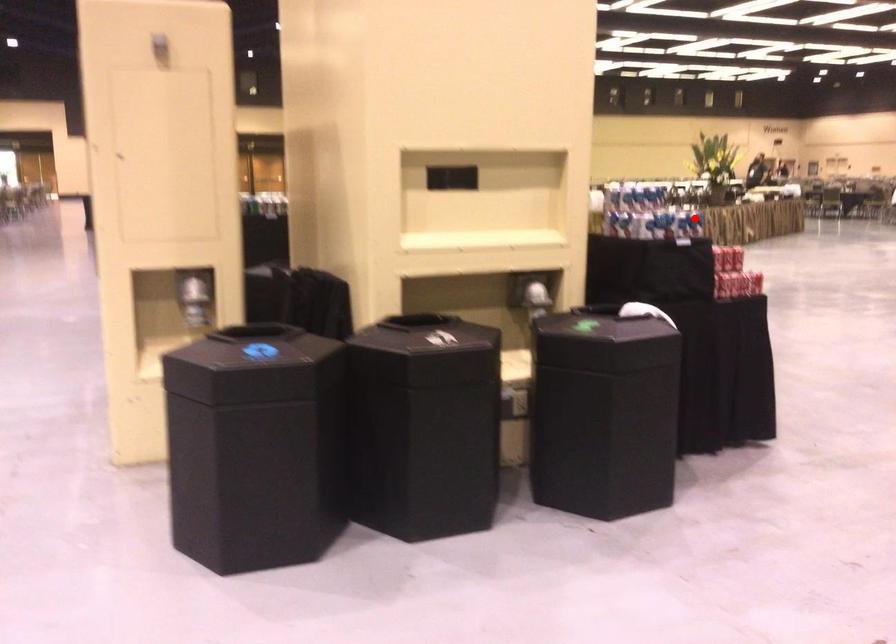
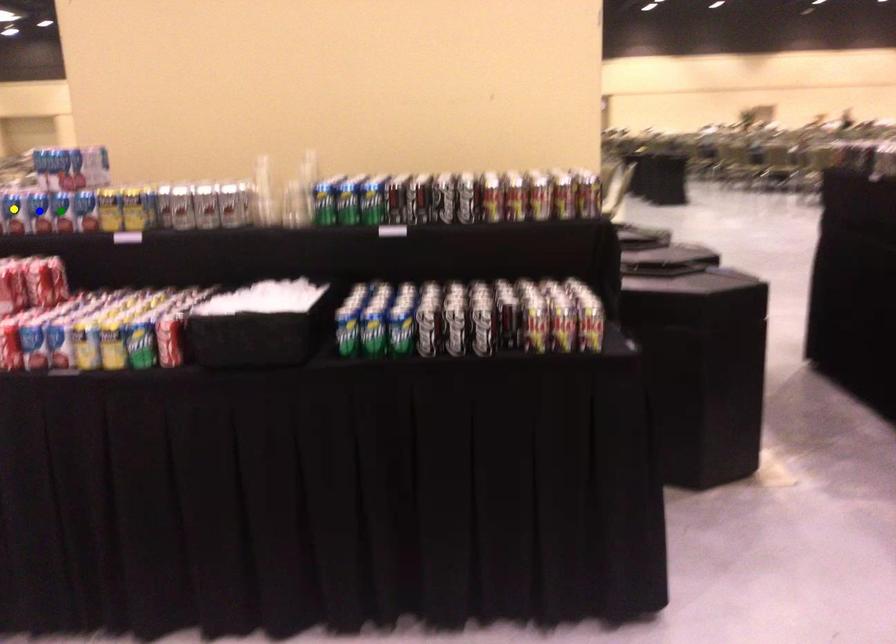
Question: I am providing you with two images of the same scene from different viewpoints. A red point is marked on the first image. You are given multiple points on the second image. Which spot in image 2 lines up with the point in image 1?

Choices:
 (A) yellow point
 (B) green point
 (C) blue point

Answer: (A)